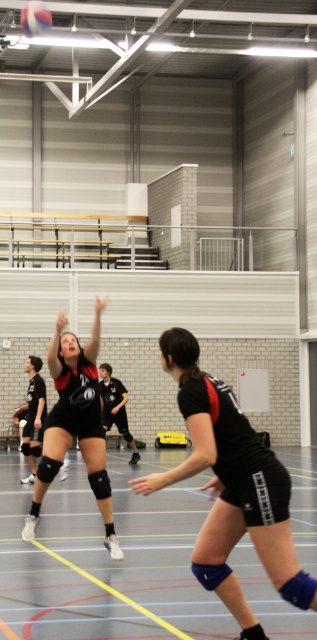
Question: In this image, where is rubberized black volleyball court at center located relative to black matte shorts at center?

Choices:
 (A) left
 (B) right

Answer: (A)

Question: Is rubberized black volleyball court at center below black matte uniform at center?

Choices:
 (A) no
 (B) yes

Answer: (B)

Question: Based on their relative distances, which object is farther from the rubberized black volleyball court at center?

Choices:
 (A) white matte volleyball at upper left
 (B) black matte uniform at center
 (C) black matte shorts at center

Answer: (A)

Question: Does rubberized black volleyball court at center have a greater width compared to black matte shorts at center?

Choices:
 (A) yes
 (B) no

Answer: (A)

Question: Which of the following is the closest to the observer?

Choices:
 (A) (21, 10)
 (B) (25, 493)
 (C) (39, 499)
 (D) (278, 564)

Answer: (D)

Question: Among these objects, which one is nearest to the camera?

Choices:
 (A) rubberized black volleyball court at center
 (B) white matte volleyball at upper left

Answer: (A)